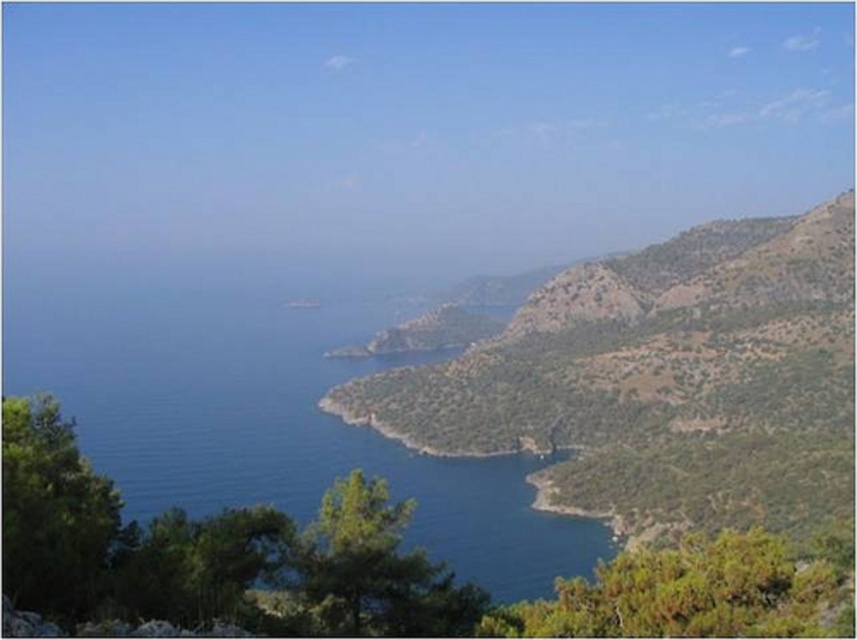
You are standing at the viewpoint overlooking the coastal landscape. You notice two points marked on the image. Which point, point (640, 346) or point (322, 330), is physically closer to your current position?

Point (640, 346) is closer to the camera than point (322, 330), so it is physically closer to your current position.